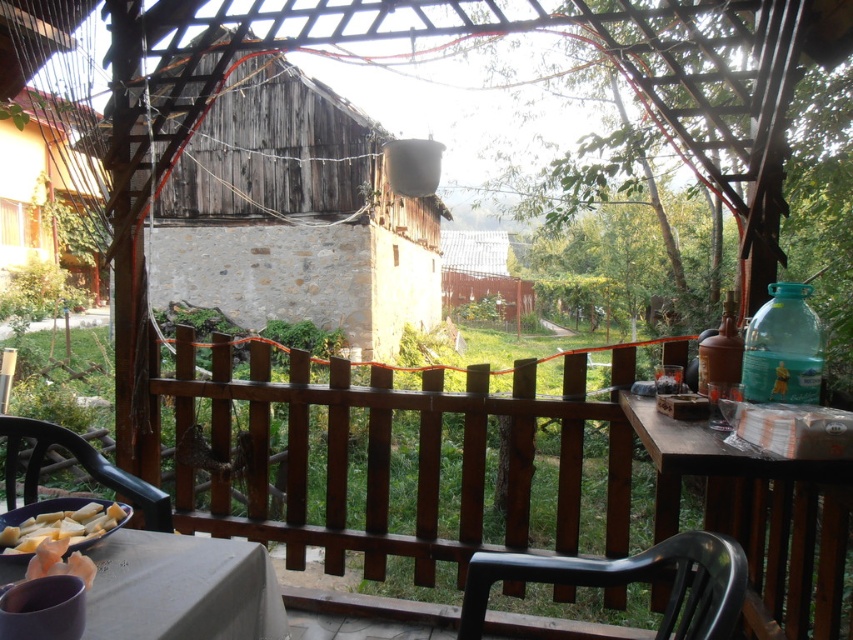
Between white fabric table at lower left and black plastic chair at lower right, which one is positioned lower?

white fabric table at lower left

Does white fabric table at lower left have a larger size compared to black plastic chair at lower right?

Actually, white fabric table at lower left might be smaller than black plastic chair at lower right.

Which is in front, point (213, 627) or point (672, 545)?

Point (213, 627) is more forward.

What are the coordinates of `white fabric table at lower left` in the screenshot? It's located at (183, 588).

Which is above, brown wooden fence at center or black plastic chair at lower left?

Positioned higher is brown wooden fence at center.

This screenshot has height=640, width=853. What are the coordinates of `brown wooden fence at center` in the screenshot? It's located at (506, 474).

Who is taller, black plastic chair at lower left or metallic corrugated roof at center?

With more height is metallic corrugated roof at center.

Is black plastic chair at lower left thinner than metallic corrugated roof at center?

Yes, black plastic chair at lower left is thinner than metallic corrugated roof at center.

Who is more distant from viewer, (62, 433) or (448, 257)?

The point (448, 257) is more distant.

Where is `black plastic chair at lower left`? black plastic chair at lower left is located at coordinates (80, 465).